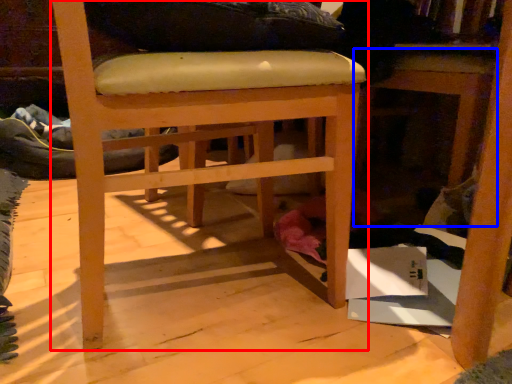
Question: Which object is closer to the camera taking this photo, chair (highlighted by a red box) or table (highlighted by a blue box)?

Choices:
 (A) chair
 (B) table

Answer: (A)